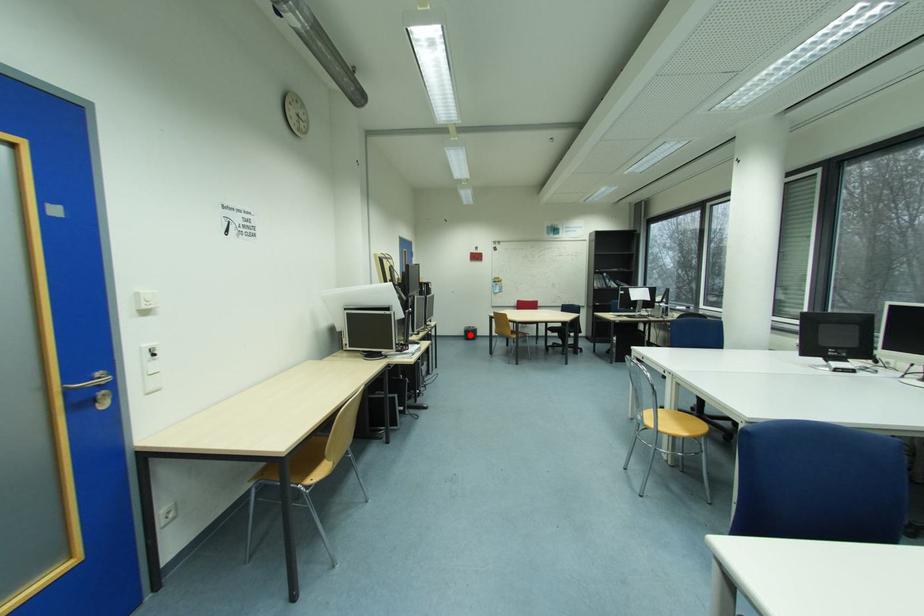
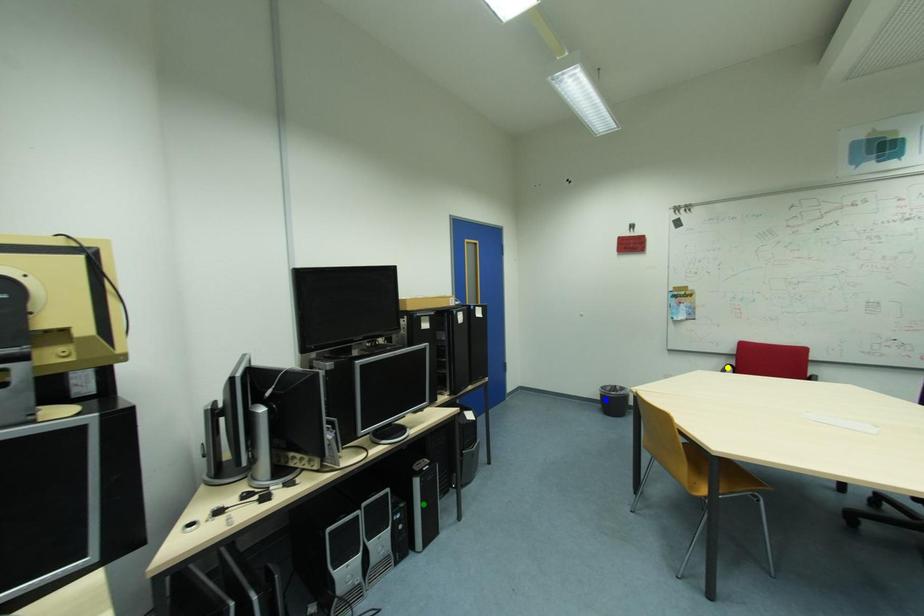
Question: I am providing you with two images of the same scene from different viewpoints. A red point is marked on the first image. You are given multiple points on the second image. Which spot in image 2 lines up with the point in image 1?

Choices:
 (A) green point
 (B) blue point
 (C) yellow point

Answer: (B)